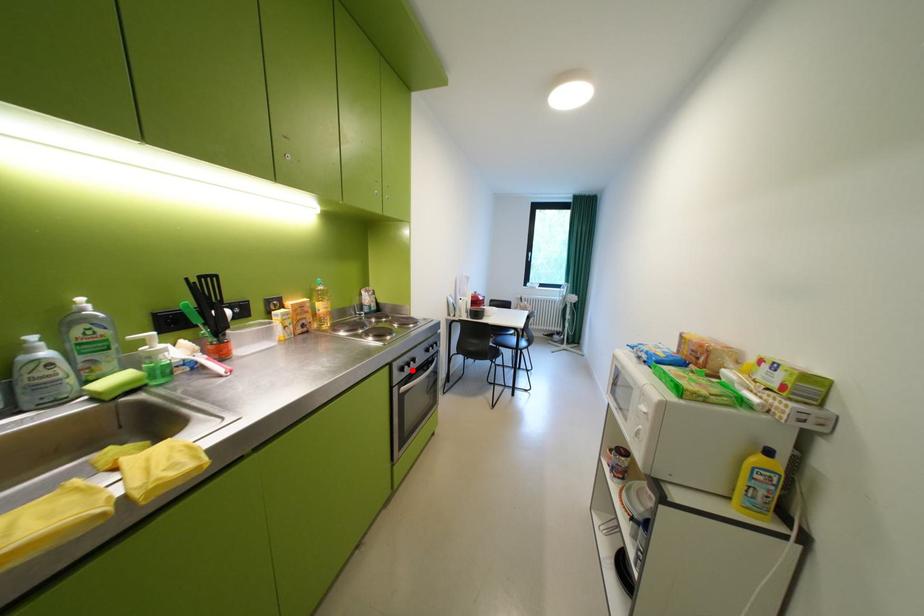
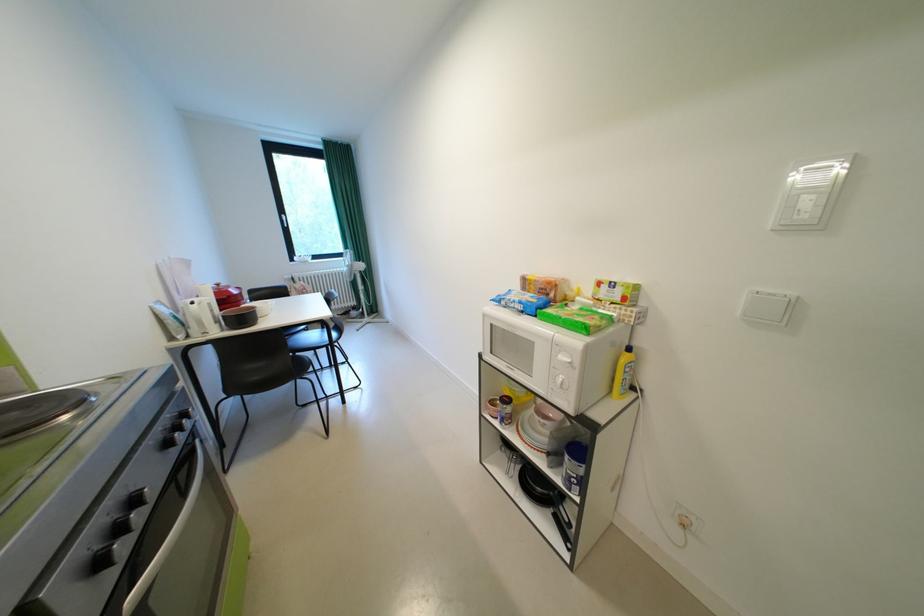
Question: I am providing you with two images of the same scene from different viewpoints. A red point is marked on the first image. Is the red point's position out of view in image 2?

Choices:
 (A) Yes
 (B) No

Answer: (B)